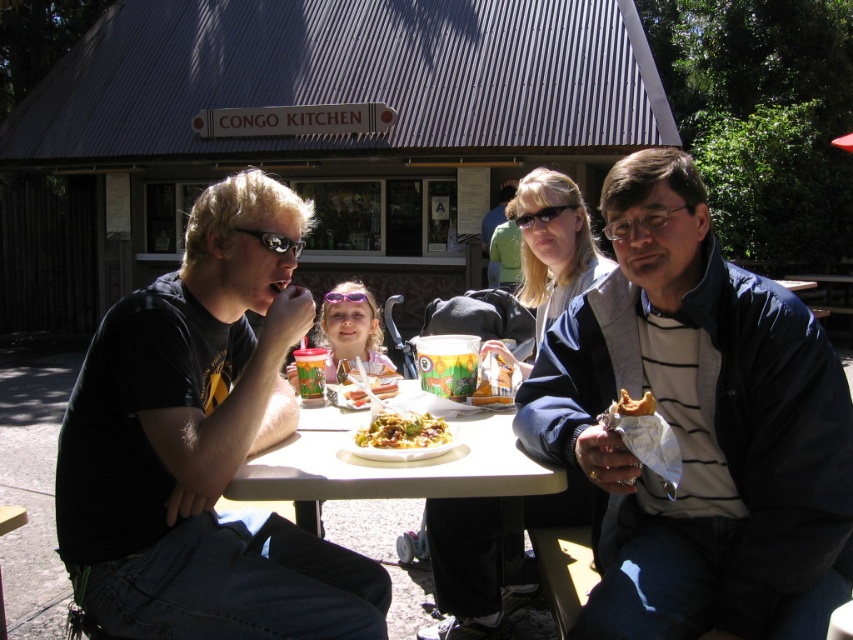
You are standing in front of the Congo Kitchen food stall and want to take a photo of the two points mentioned. Which point, point [608,616] or point [263,232], will appear larger in your photo?

Point [608,616] will appear larger in the photo because it is closer to the camera than point [263,232].

Based on the photo, you are a customer at Congo Kitchen and you see the golden crispy sandwich at center and the golden brown bread at center on the table. Which one is directly above the other?

The golden brown bread at center is directly above the golden crispy sandwich at center because the sandwich is positioned under the bread.